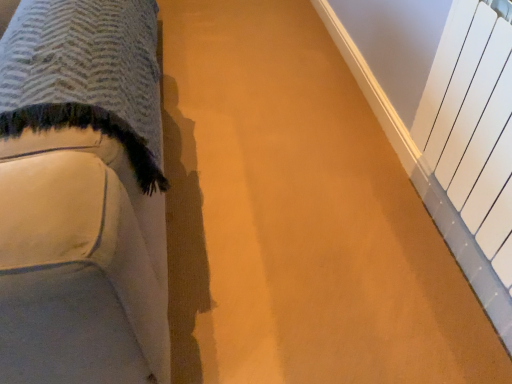
Question: From the image's perspective, would you say white fabric couch at left is positioned over white matte radiator at right?

Choices:
 (A) yes
 (B) no

Answer: (A)

Question: Does white fabric couch at left have a lesser height compared to white matte radiator at right?

Choices:
 (A) no
 (B) yes

Answer: (A)

Question: Could white matte radiator at right be considered to be inside white fabric couch at left?

Choices:
 (A) yes
 (B) no

Answer: (B)

Question: Considering the relative sizes of white fabric couch at left and white matte radiator at right in the image provided, is white fabric couch at left smaller than white matte radiator at right?

Choices:
 (A) no
 (B) yes

Answer: (A)

Question: Is white fabric couch at left wider than white matte radiator at right?

Choices:
 (A) yes
 (B) no

Answer: (A)

Question: Does white fabric couch at left lie behind white matte radiator at right?

Choices:
 (A) yes
 (B) no

Answer: (B)

Question: Is white matte radiator at right oriented towards white fabric couch at left?

Choices:
 (A) yes
 (B) no

Answer: (A)

Question: From the image's perspective, is white matte radiator at right located beneath white fabric couch at left?

Choices:
 (A) no
 (B) yes

Answer: (B)

Question: Is white fabric couch at left surrounded by white matte radiator at right?

Choices:
 (A) no
 (B) yes

Answer: (A)

Question: Does white matte radiator at right have a greater width compared to white fabric couch at left?

Choices:
 (A) yes
 (B) no

Answer: (B)

Question: Is white matte radiator at right outside of white fabric couch at left?

Choices:
 (A) yes
 (B) no

Answer: (A)

Question: Can you confirm if white matte radiator at right is thinner than white fabric couch at left?

Choices:
 (A) yes
 (B) no

Answer: (A)

Question: Is white fabric couch at left inside the boundaries of white matte radiator at right, or outside?

Choices:
 (A) outside
 (B) inside

Answer: (A)